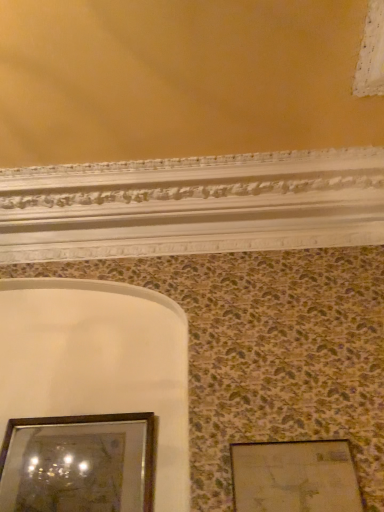
Question: From the image's perspective, is wooden framed mirror at lower left, arranged as the first picture frame when viewed from the left, located above wooden picture frame at lower right, arranged as the second picture frame when viewed from the left?

Choices:
 (A) yes
 (B) no

Answer: (B)

Question: Does wooden framed mirror at lower left, marked as the 2th picture frame in a right-to-left arrangement, have a smaller size compared to wooden picture frame at lower right, the 1th picture frame positioned from the right?

Choices:
 (A) yes
 (B) no

Answer: (B)

Question: Can you confirm if wooden framed mirror at lower left, marked as the 2th picture frame in a right-to-left arrangement, is thinner than wooden picture frame at lower right, the 1th picture frame positioned from the right?

Choices:
 (A) yes
 (B) no

Answer: (B)

Question: From the image's perspective, would you say wooden framed mirror at lower left, arranged as the first picture frame when viewed from the left, is shown under wooden picture frame at lower right, arranged as the second picture frame when viewed from the left?

Choices:
 (A) yes
 (B) no

Answer: (A)

Question: Can you confirm if wooden framed mirror at lower left, marked as the 2th picture frame in a right-to-left arrangement, is bigger than wooden picture frame at lower right, the 1th picture frame positioned from the right?

Choices:
 (A) no
 (B) yes

Answer: (B)

Question: Can you confirm if wooden framed mirror at lower left, arranged as the first picture frame when viewed from the left, is taller than wooden picture frame at lower right, arranged as the second picture frame when viewed from the left?

Choices:
 (A) no
 (B) yes

Answer: (B)

Question: Considering the relative sizes of wooden picture frame at lower right, arranged as the second picture frame when viewed from the left, and wooden framed mirror at lower left, arranged as the first picture frame when viewed from the left, in the image provided, is wooden picture frame at lower right, arranged as the second picture frame when viewed from the left, smaller than wooden framed mirror at lower left, arranged as the first picture frame when viewed from the left,?

Choices:
 (A) yes
 (B) no

Answer: (A)

Question: Can you confirm if wooden picture frame at lower right, arranged as the second picture frame when viewed from the left, is shorter than wooden framed mirror at lower left, marked as the 2th picture frame in a right-to-left arrangement?

Choices:
 (A) no
 (B) yes

Answer: (B)

Question: Would you say wooden framed mirror at lower left, arranged as the first picture frame when viewed from the left, is part of wooden picture frame at lower right, the 1th picture frame positioned from the right,'s contents?

Choices:
 (A) no
 (B) yes

Answer: (A)

Question: Is wooden picture frame at lower right, the 1th picture frame positioned from the right, closer to the viewer compared to wooden framed mirror at lower left, arranged as the first picture frame when viewed from the left?

Choices:
 (A) yes
 (B) no

Answer: (A)

Question: Is wooden picture frame at lower right, arranged as the second picture frame when viewed from the left, completely or partially outside of wooden framed mirror at lower left, marked as the 2th picture frame in a right-to-left arrangement?

Choices:
 (A) no
 (B) yes

Answer: (B)

Question: From a real-world perspective, is wooden picture frame at lower right, the 1th picture frame positioned from the right, positioned over wooden framed mirror at lower left, marked as the 2th picture frame in a right-to-left arrangement, based on gravity?

Choices:
 (A) yes
 (B) no

Answer: (B)

Question: From the image's perspective, is wooden picture frame at lower right, the 1th picture frame positioned from the right, positioned above or below wooden framed mirror at lower left, marked as the 2th picture frame in a right-to-left arrangement?

Choices:
 (A) above
 (B) below

Answer: (A)